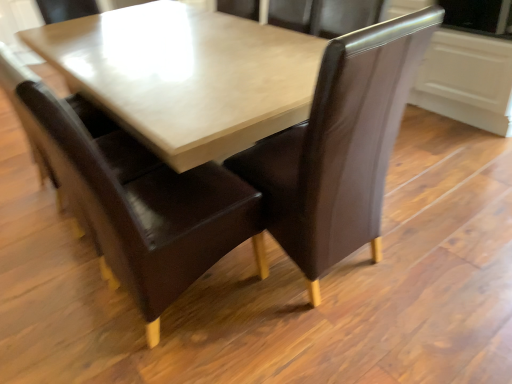
Question: Would you say brown leather chair at center, the first chair in the left-to-right sequence, is to the left or to the right of brown leather chair at center, the 1th chair when ordered from right to left, in the picture?

Choices:
 (A) left
 (B) right

Answer: (A)

Question: Is brown leather chair at center, the 2th chair in the right-to-left sequence, in front of or behind brown leather chair at center, which appears as the second chair when viewed from the left, in the image?

Choices:
 (A) behind
 (B) front

Answer: (B)

Question: Is brown leather chair at center, the first chair in the left-to-right sequence, wider or thinner than brown leather chair at center, the 1th chair when ordered from right to left?

Choices:
 (A) thin
 (B) wide

Answer: (B)

Question: Would you say brown leather chair at center, which appears as the second chair when viewed from the left, is inside or outside brown leather chair at center, the 2th chair in the right-to-left sequence?

Choices:
 (A) inside
 (B) outside

Answer: (B)

Question: Is brown leather chair at center, the 1th chair when ordered from right to left, to the left or to the right of brown leather chair at center, the 2th chair in the right-to-left sequence, in the image?

Choices:
 (A) right
 (B) left

Answer: (A)

Question: In the image, is brown leather chair at center, which appears as the second chair when viewed from the left, positioned in front of or behind brown leather chair at center, the first chair in the left-to-right sequence?

Choices:
 (A) behind
 (B) front

Answer: (A)

Question: Is brown leather chair at center, the 1th chair when ordered from right to left, wider or thinner than brown leather chair at center, the first chair in the left-to-right sequence?

Choices:
 (A) wide
 (B) thin

Answer: (B)